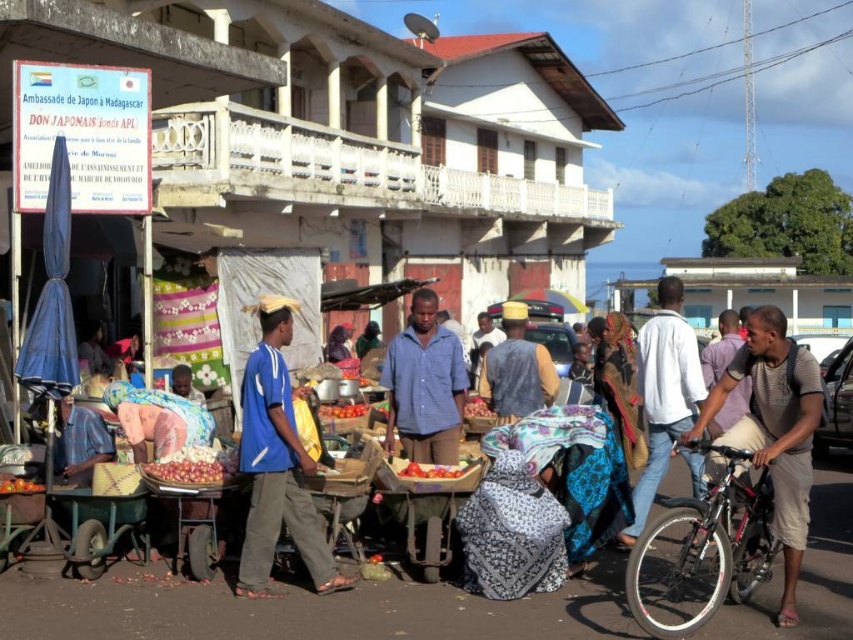
Question: Considering the relative positions of white matte jacket at center and ripe red tomato at center in the image provided, where is white matte jacket at center located with respect to ripe red tomato at center?

Choices:
 (A) above
 (B) below

Answer: (A)

Question: Which of the following is the farthest from the observer?

Choices:
 (A) shiny red onions at lower left
 (B) blue fabric bag at center
 (C) white matte jacket at center

Answer: (A)

Question: Which is farther from the shiny red onions at lower left?

Choices:
 (A) yellow fabric hat at center
 (B) white matte jacket at center
 (C) blue fabric bag at center
 (D) ripe red tomato at center

Answer: (B)

Question: Can you confirm if red glossy tomatoes at center is bigger than ripe red tomato at center?

Choices:
 (A) no
 (B) yes

Answer: (A)

Question: Which object is closer to the camera taking this photo?

Choices:
 (A) yellow fabric hat at center
 (B) shiny red onions at lower left
 (C) blue fabric bag at center

Answer: (C)

Question: In this image, where is blue fabric bag at center located relative to red glossy tomatoes at center?

Choices:
 (A) above
 (B) below

Answer: (A)